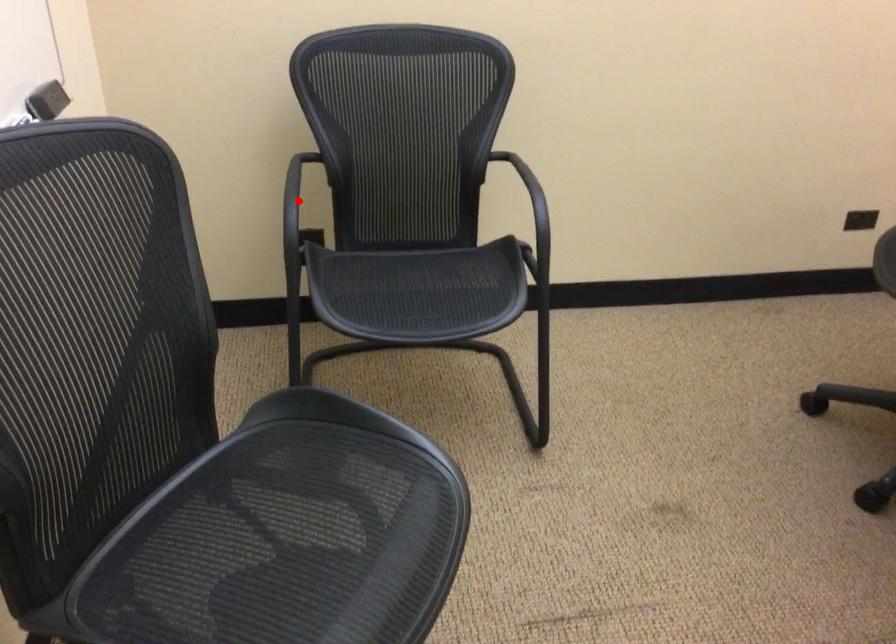
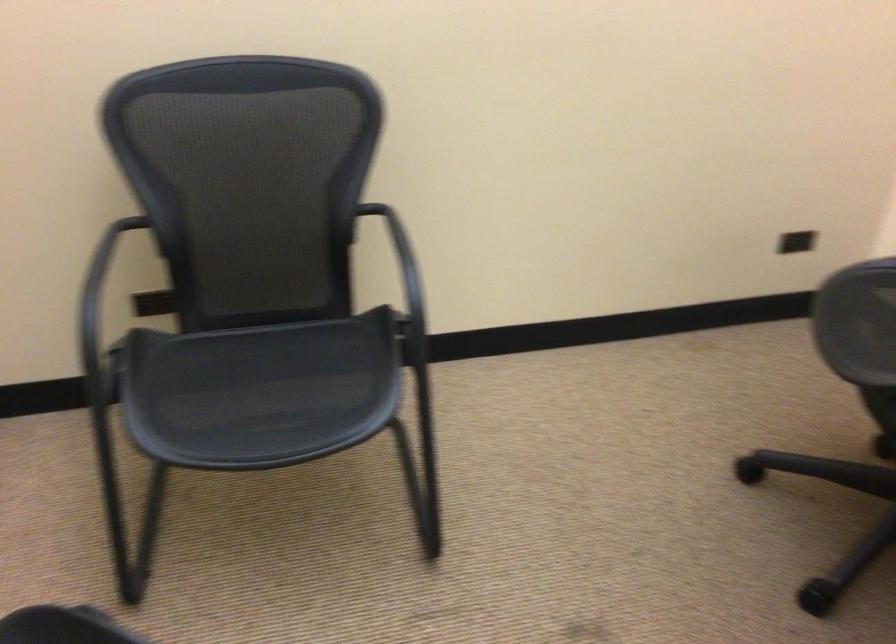
Question: I am providing you with two images of the same scene from different viewpoints. A red point is marked on the first image. Can you still see the location of the red point in image 2?

Choices:
 (A) Yes
 (B) No

Answer: (B)